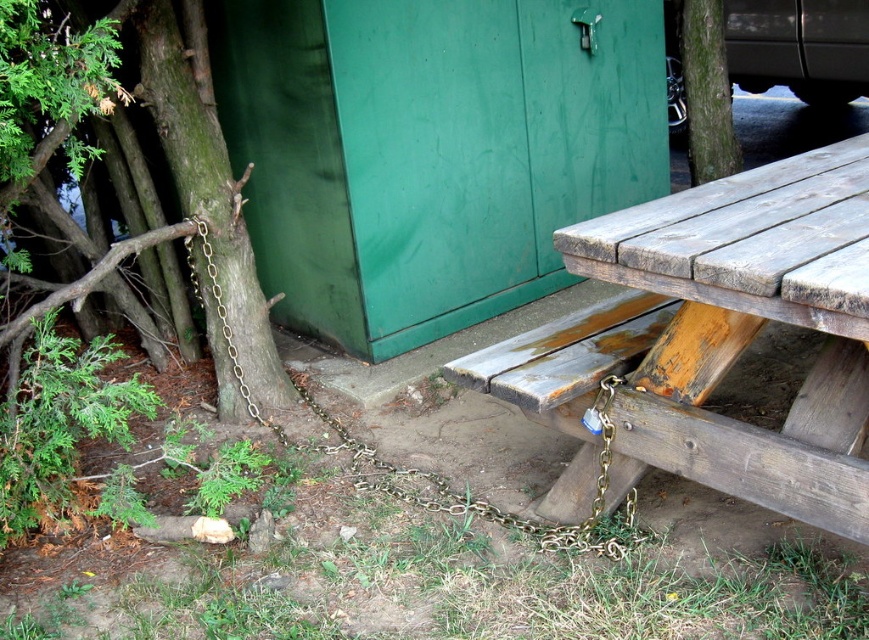
Is point (554, 371) positioned after point (187, 237)?

No, (554, 371) is in front of (187, 237).

Is rusty wood picnic table at lower right taller than gold chain at lower left?

Yes, rusty wood picnic table at lower right is taller than gold chain at lower left.

Is point (763, 458) closer to camera compared to point (216, 289)?

Yes, it is.

Image resolution: width=869 pixels, height=640 pixels. Identify the location of rusty wood picnic table at lower right. (712, 339).

Can you confirm if green rough bark tree at upper right is bigger than gold chain at lower left?

Indeed, green rough bark tree at upper right has a larger size compared to gold chain at lower left.

Between point (722, 163) and point (211, 262), which one is positioned behind?

Positioned behind is point (722, 163).

You are a GUI agent. You are given a task and a screenshot of the screen. Output one action in this format:
    pyautogui.click(x=<x>, y=<y>)
    Task: Click on the green rough bark tree at upper right
    Image resolution: width=869 pixels, height=640 pixels.
    Given the screenshot: What is the action you would take?
    pyautogui.click(x=706, y=92)

Can you confirm if green rough bark tree at left is smaller than gold chain at lower left?

Actually, green rough bark tree at left might be larger than gold chain at lower left.

What do you see at coordinates (209, 182) in the screenshot? I see `green rough bark tree at left` at bounding box center [209, 182].

This screenshot has width=869, height=640. I want to click on green rough bark tree at left, so click(x=209, y=182).